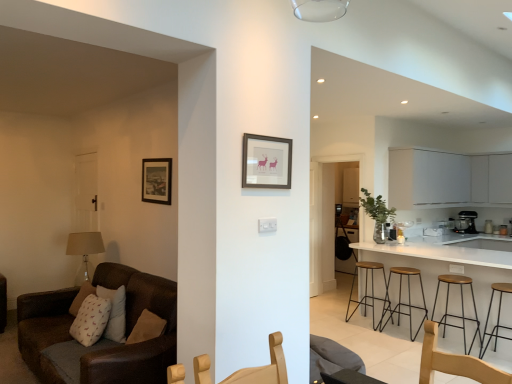
Question: Is wooden stool at lower right, placed as the fourth stool when sorted from back to front, taller than white glossy counter top at right?

Choices:
 (A) yes
 (B) no

Answer: (B)

Question: Is wooden stool at lower right, placed as the fourth stool when sorted from back to front, smaller than white glossy counter top at right?

Choices:
 (A) no
 (B) yes

Answer: (B)

Question: Does wooden stool at lower right, the 1th stool in the front-to-back sequence, have a lesser width compared to white glossy counter top at right?

Choices:
 (A) yes
 (B) no

Answer: (A)

Question: Does wooden stool at lower right, placed as the fourth stool when sorted from back to front, have a larger size compared to white glossy counter top at right?

Choices:
 (A) no
 (B) yes

Answer: (A)

Question: Is wooden stool at lower right, placed as the fourth stool when sorted from back to front, in contact with white glossy counter top at right?

Choices:
 (A) no
 (B) yes

Answer: (A)

Question: Is white glossy counter top at right at the back of wooden stool at lower right, placed as the fourth stool when sorted from back to front?

Choices:
 (A) yes
 (B) no

Answer: (A)

Question: Considering the relative sizes of wooden seat stool at right, the second stool in the front-to-back sequence, and brown leather couch at left in the image provided, is wooden seat stool at right, the second stool in the front-to-back sequence, taller than brown leather couch at left?

Choices:
 (A) no
 (B) yes

Answer: (A)

Question: Can you confirm if wooden seat stool at right, which is the third stool in back-to-front order, is shorter than brown leather couch at left?

Choices:
 (A) no
 (B) yes

Answer: (B)

Question: Is wooden seat stool at right, which is the third stool in back-to-front order, outside of brown leather couch at left?

Choices:
 (A) no
 (B) yes

Answer: (B)

Question: From a real-world perspective, is wooden seat stool at right, the second stool in the front-to-back sequence, located beneath brown leather couch at left?

Choices:
 (A) yes
 (B) no

Answer: (A)

Question: Is brown leather couch at left surrounded by wooden seat stool at right, which is the third stool in back-to-front order?

Choices:
 (A) yes
 (B) no

Answer: (B)

Question: Is wooden seat stool at right, which is the third stool in back-to-front order, to the right of brown leather couch at left from the viewer's perspective?

Choices:
 (A) no
 (B) yes

Answer: (B)

Question: Can you confirm if wooden seat at right, the second stool viewed from the back, is bigger than white matte cabinet at upper right?

Choices:
 (A) no
 (B) yes

Answer: (A)